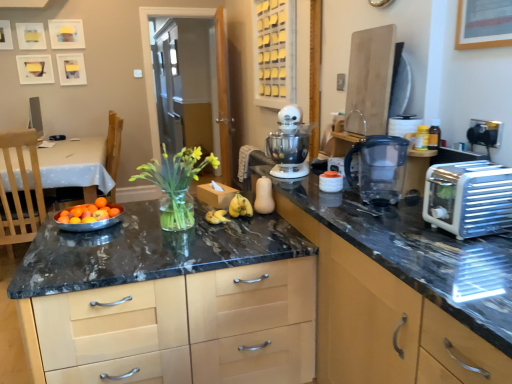
Question: Does white plastic toaster at right have a greater width compared to matte black toaster at right, which is the second cabinetry in bottom-to-top order?

Choices:
 (A) yes
 (B) no

Answer: (B)

Question: Is white plastic toaster at right not within matte black toaster at right, which is the second cabinetry in bottom-to-top order?

Choices:
 (A) yes
 (B) no

Answer: (A)

Question: Is the position of white plastic toaster at right more distant than that of matte black toaster at right, which is the second cabinetry in bottom-to-top order?

Choices:
 (A) yes
 (B) no

Answer: (A)

Question: Considering the relative sizes of white plastic toaster at right and matte black toaster at right, which is the second cabinetry in bottom-to-top order, in the image provided, is white plastic toaster at right smaller than matte black toaster at right, which is the second cabinetry in bottom-to-top order,?

Choices:
 (A) no
 (B) yes

Answer: (B)

Question: From a real-world perspective, is white plastic toaster at right physically above matte black toaster at right, which is the second cabinetry in bottom-to-top order?

Choices:
 (A) no
 (B) yes

Answer: (B)

Question: Is white plastic toaster at right looking in the opposite direction of matte black toaster at right, the 2th cabinetry positioned from the top?

Choices:
 (A) no
 (B) yes

Answer: (A)

Question: Is white plastic stand mixer at center oriented towards white plastic toaster at right?

Choices:
 (A) yes
 (B) no

Answer: (B)

Question: Is white plastic stand mixer at center touching white plastic toaster at right?

Choices:
 (A) yes
 (B) no

Answer: (B)

Question: From a real-world perspective, is white plastic stand mixer at center located beneath white plastic toaster at right?

Choices:
 (A) no
 (B) yes

Answer: (A)

Question: Is white plastic stand mixer at center to the right of white plastic toaster at right from the viewer's perspective?

Choices:
 (A) no
 (B) yes

Answer: (A)

Question: Does white plastic stand mixer at center come in front of white plastic toaster at right?

Choices:
 (A) yes
 (B) no

Answer: (B)

Question: Is white plastic stand mixer at center taller than white plastic toaster at right?

Choices:
 (A) no
 (B) yes

Answer: (B)

Question: Considering the relative sizes of yellow matte bananas at center and white plastic toaster at right in the image provided, is yellow matte bananas at center thinner than white plastic toaster at right?

Choices:
 (A) yes
 (B) no

Answer: (A)